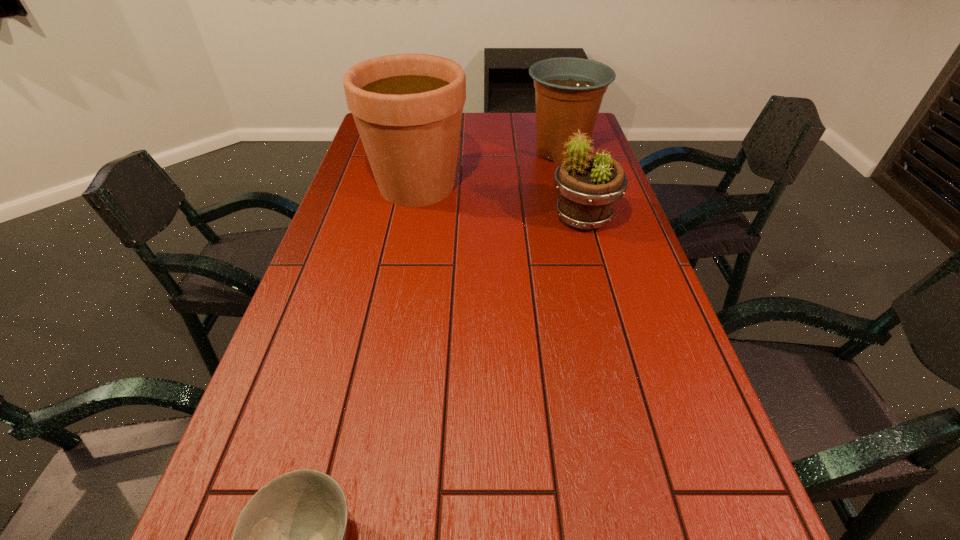
What are the coordinates of `the tallest flowerpot` in the screenshot? It's located at (408, 108).

Image resolution: width=960 pixels, height=540 pixels. In order to click on the tallest object in this screenshot , I will do `click(408, 108)`.

Locate an element on the screen. vacant region located on the back of the tallest object is located at coordinates (430, 113).

Find the location of a particular element. object that is positioned at the far edge is located at coordinates (568, 91).

Identify the location of object located at the left edge. (408, 108).

This screenshot has height=540, width=960. I want to click on object at the far right corner, so click(568, 91).

You are a GUI agent. You are given a task and a screenshot of the screen. Output one action in this format:
    pyautogui.click(x=<x>, y=<y>)
    Task: Click on the vacant space at the far edge of the desktop
    
    Given the screenshot: What is the action you would take?
    pyautogui.click(x=510, y=120)

Identify the location of free point at the left edge. (370, 239).

In the image, there is a desktop. Where is `free region at the right edge`? free region at the right edge is located at coordinates (727, 499).

I want to click on object identified as the closest to the tallest object, so click(x=568, y=91).